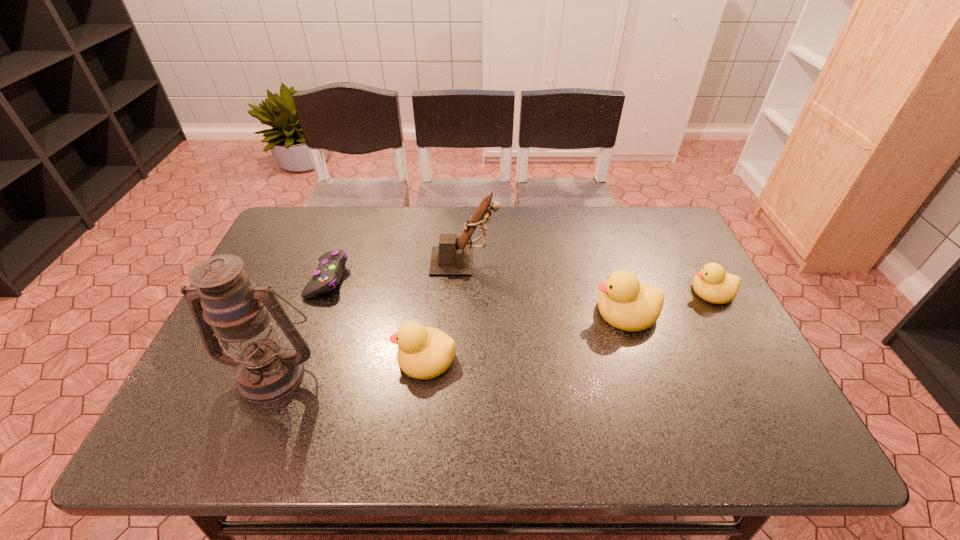
Locate an element on the screen. This screenshot has height=540, width=960. free location located on the face of the second shortest duckling is located at coordinates (306, 358).

Locate an element on the screen. free space located on the face of the second duckling from left to right is located at coordinates (445, 311).

Where is `free region located on the face of the second duckling from left to right`? The image size is (960, 540). free region located on the face of the second duckling from left to right is located at coordinates (498, 311).

The image size is (960, 540). In order to click on vacant area situated 0.370m on the face of the second duckling from left to right in this screenshot , I will do `click(453, 311)`.

At what (x,y) coordinates should I click in order to perform the action: click on vacant area located on the face of the rightmost object. Please return your answer as a coordinate pair (x, y). Looking at the image, I should click on (545, 291).

What are the coordinates of `vacant area located 0.100m on the face of the rightmost object` in the screenshot? It's located at (653, 291).

Identify the location of free space located 0.400m on the face of the rightmost object. point(545,291).

You are a GUI agent. You are given a task and a screenshot of the screen. Output one action in this format:
    pyautogui.click(x=<x>, y=<y>)
    Task: Click on the free space located 0.350m on the right of the shortest object
    The height and width of the screenshot is (540, 960).
    Given the screenshot: What is the action you would take?
    pyautogui.click(x=468, y=279)

I want to click on vacant space located 0.290m on the front-facing side of the fifth shortest object, so click(595, 261).

Image resolution: width=960 pixels, height=540 pixels. In order to click on free region located 0.110m on the back of the tallest object in this screenshot , I will do `click(298, 312)`.